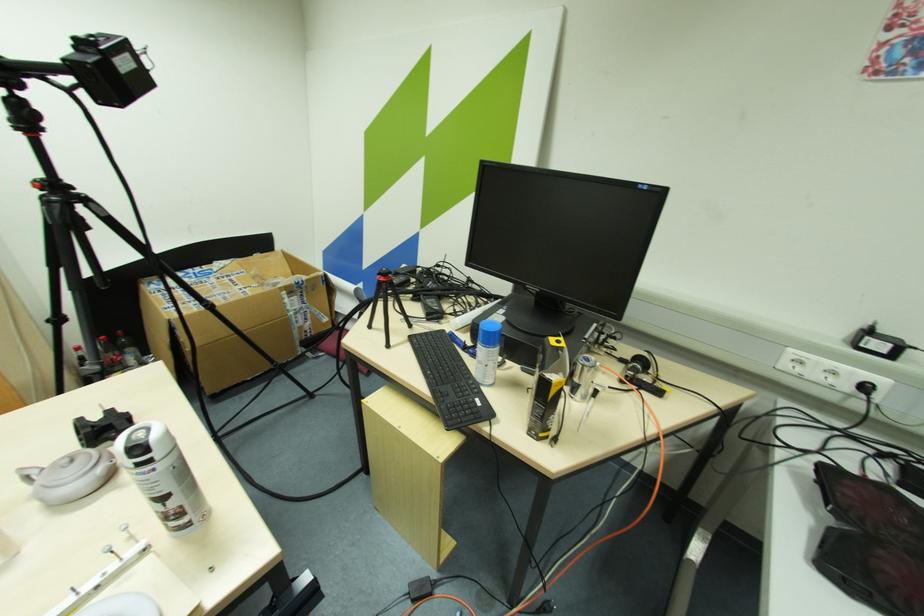
Locate an element on the screen. silver metal can is located at coordinates (162, 477).